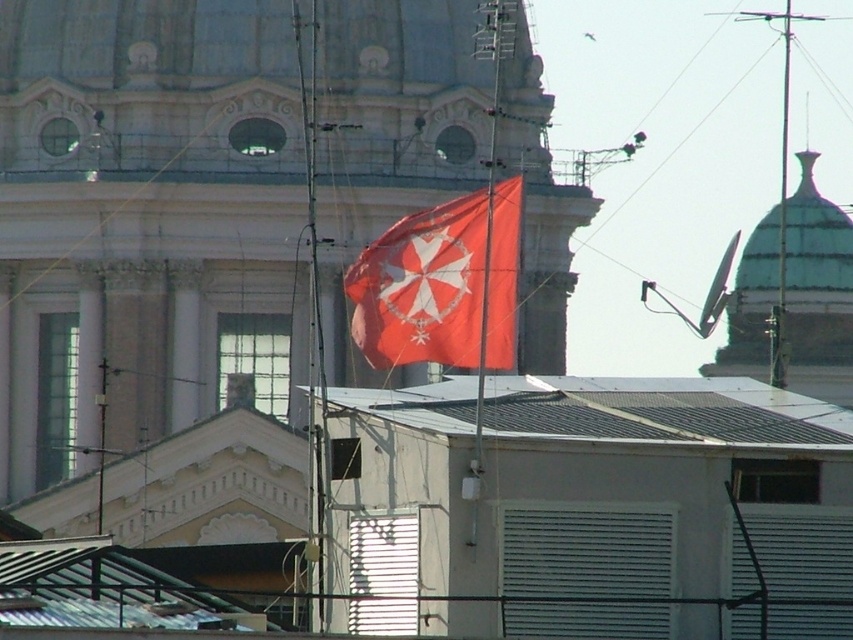
Question: Which object is positioned closest to the gray metal roof at center?

Choices:
 (A) green glazed dome at upper right
 (B) matte red flag at center
 (C) smooth stone dome at upper center

Answer: (B)

Question: Which point is closer to the camera?

Choices:
 (A) gray metal roof at center
 (B) green glazed dome at upper right
 (C) smooth stone dome at upper center
 (D) matte red flag at center

Answer: (A)

Question: Can you confirm if smooth stone dome at upper center is positioned to the left of matte red flag at center?

Choices:
 (A) no
 (B) yes

Answer: (B)

Question: Is smooth stone dome at upper center to the right of gray metal roof at center from the viewer's perspective?

Choices:
 (A) yes
 (B) no

Answer: (B)

Question: Which object appears farthest from the camera in this image?

Choices:
 (A) gray metal roof at center
 (B) green glazed dome at upper right

Answer: (B)

Question: Can you confirm if smooth stone dome at upper center is wider than green glazed dome at upper right?

Choices:
 (A) yes
 (B) no

Answer: (A)